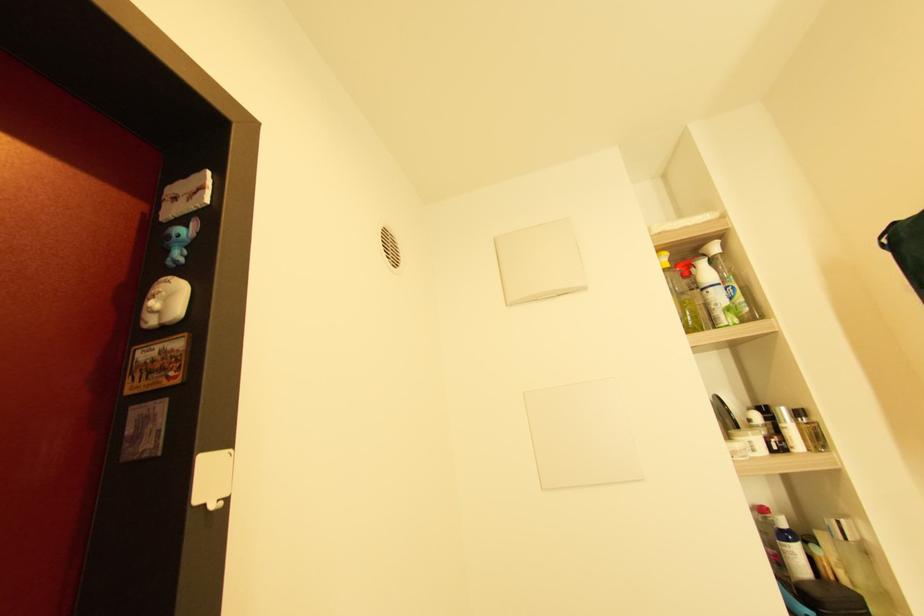
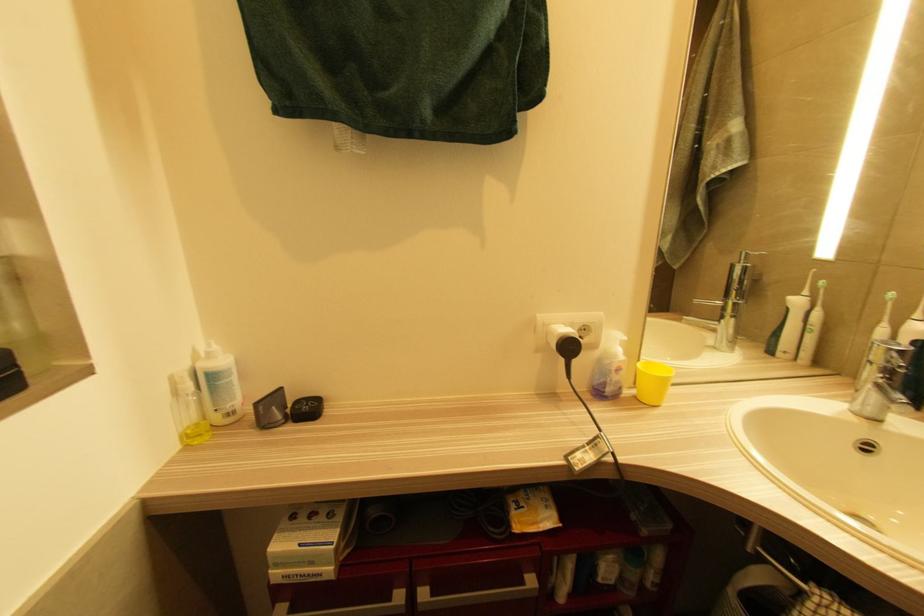
Question: The images are taken continuously from a first-person perspective. In which direction is your viewpoint rotating?

Choices:
 (A) Left
 (B) Right
 (C) Up
 (D) Down

Answer: (B)